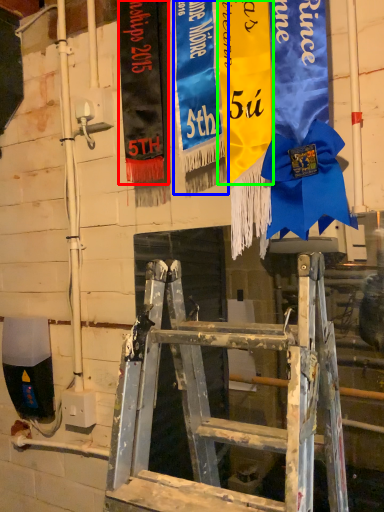
Question: Considering the real-world distances, which object is farthest from tapestry (highlighted by a red box)? tapestry (highlighted by a blue box) or tapestry (highlighted by a green box)?

Choices:
 (A) tapestry
 (B) tapestry

Answer: (B)